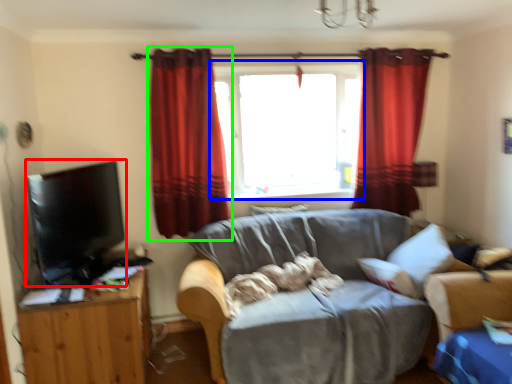
Question: Estimate the real-world distances between objects in this image. Which object is closer to flat (highlighted by a red box), window (highlighted by a blue box) or curtain (highlighted by a green box)?

Choices:
 (A) window
 (B) curtain

Answer: (B)